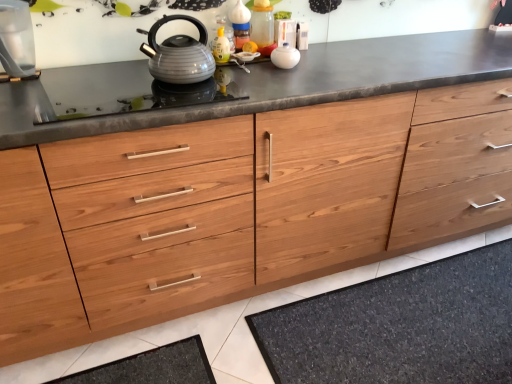
In order to click on vacant space in front of matte gray kettle at center in this screenshot , I will do `click(187, 93)`.